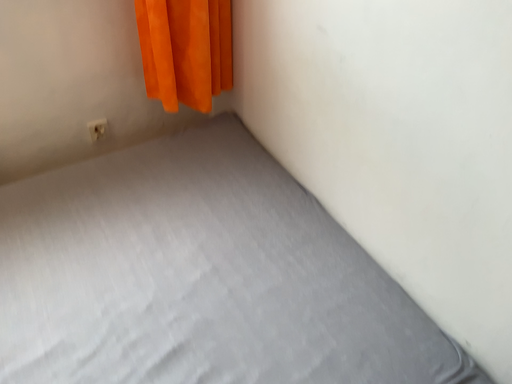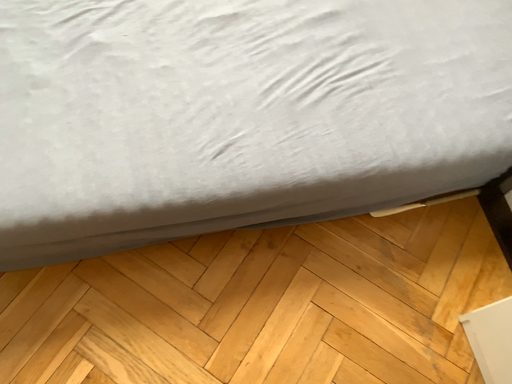
Question: Which way did the camera rotate in the video?

Choices:
 (A) rotated left
 (B) rotated right

Answer: (A)